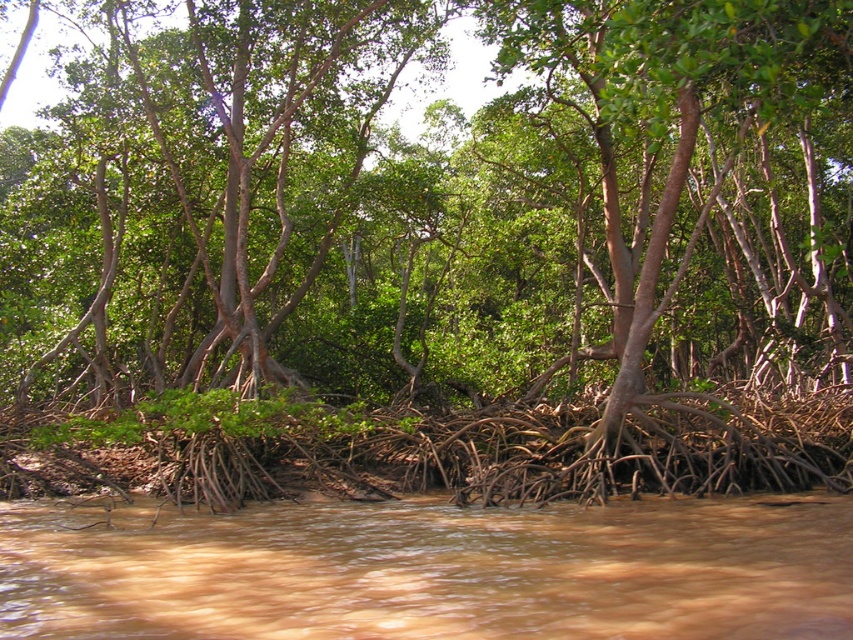
You are standing at the edge of the mangrove forest and notice the green matte tree at center and the brown muddy water at lower center. Which object is higher in elevation?

The green matte tree at center is much taller than the brown muddy water at lower center, so it is higher in elevation.

You are standing at point A with coordinates point A at (375,83) and want to reach point B at 0.350, 0.670 in the dense mangrove forest. The mangrove roots form a complex network that can only allow passage through paths narrower than 100 feet. Can you safely navigate from point A to point B?

The distance between point A at (375,83) and point B at 0.350, 0.670 is 124.21 feet, which is wider than the 100 feet path restriction imposed by the mangrove roots. Therefore, you cannot safely navigate from point A to point B through the narrow paths available.

You are a bird flying over a mangrove forest. You see a green matte tree at center and brown muddy water at lower center. Which object is bigger in size?

The green matte tree at center has a larger size compared to the brown muddy water at lower center.